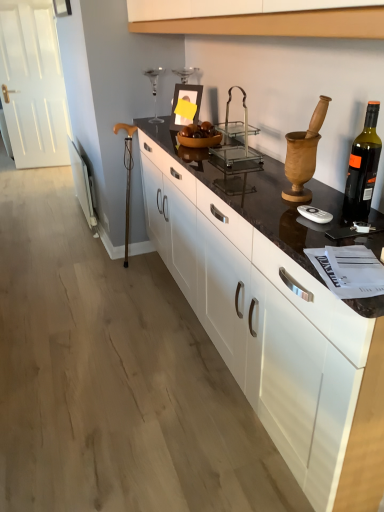
Question: Does black glass bottle at right have a lesser width compared to black marble countertop at center?

Choices:
 (A) yes
 (B) no

Answer: (A)

Question: Would you say black glass bottle at right contains black marble countertop at center?

Choices:
 (A) no
 (B) yes

Answer: (A)

Question: Can you confirm if black glass bottle at right is taller than black marble countertop at center?

Choices:
 (A) yes
 (B) no

Answer: (B)

Question: Would you say black glass bottle at right is a long distance from black marble countertop at center?

Choices:
 (A) no
 (B) yes

Answer: (A)

Question: Is black glass bottle at right closer to camera compared to black marble countertop at center?

Choices:
 (A) yes
 (B) no

Answer: (B)

Question: Is black marble countertop at center inside or outside of clear glass trolley at center?

Choices:
 (A) inside
 (B) outside

Answer: (B)

Question: Does point (342, 486) appear closer or farther from the camera than point (233, 152)?

Choices:
 (A) farther
 (B) closer

Answer: (B)

Question: From their relative heights in the image, would you say black marble countertop at center is taller or shorter than clear glass trolley at center?

Choices:
 (A) short
 (B) tall

Answer: (B)

Question: From the image's perspective, relative to clear glass trolley at center, is black marble countertop at center above or below?

Choices:
 (A) above
 (B) below

Answer: (B)

Question: Is black marble countertop at center taller or shorter than black glass bottle at right?

Choices:
 (A) tall
 (B) short

Answer: (A)

Question: From the image's perspective, is black marble countertop at center located above or below black glass bottle at right?

Choices:
 (A) above
 (B) below

Answer: (B)

Question: Is black marble countertop at center situated inside black glass bottle at right or outside?

Choices:
 (A) outside
 (B) inside

Answer: (A)

Question: Is black marble countertop at center bigger or smaller than black glass bottle at right?

Choices:
 (A) big
 (B) small

Answer: (A)

Question: Is black glass bottle at right bigger or smaller than clear glass trolley at center?

Choices:
 (A) small
 (B) big

Answer: (A)

Question: In the image, is black glass bottle at right on the left side or the right side of clear glass trolley at center?

Choices:
 (A) left
 (B) right

Answer: (B)